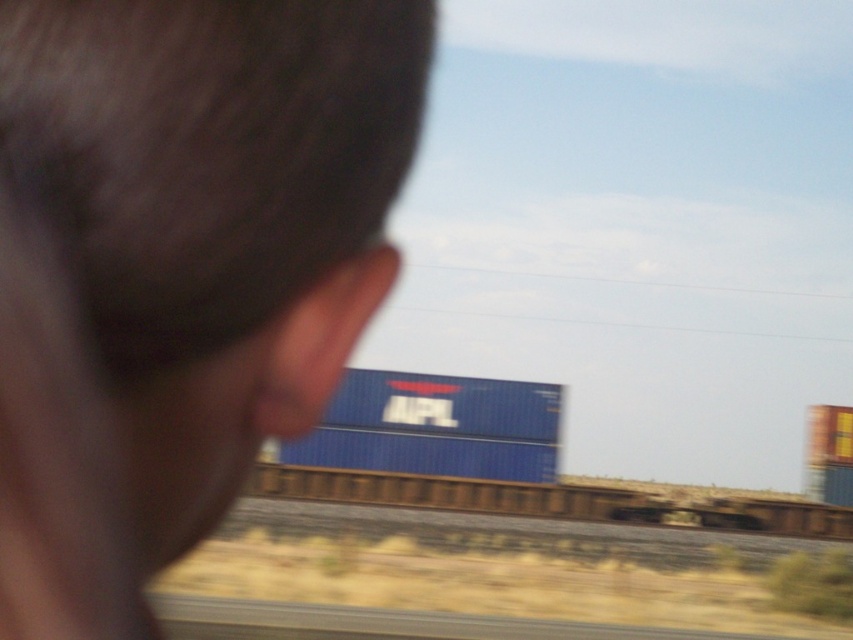
Who is positioned more to the right, blue matte container at center or blue matte train car at center?

From the viewer's perspective, blue matte train car at center appears more on the right side.

I want to click on blue matte container at center, so pyautogui.click(x=434, y=426).

The height and width of the screenshot is (640, 853). What are the coordinates of `blue matte container at center` in the screenshot? It's located at (434, 426).